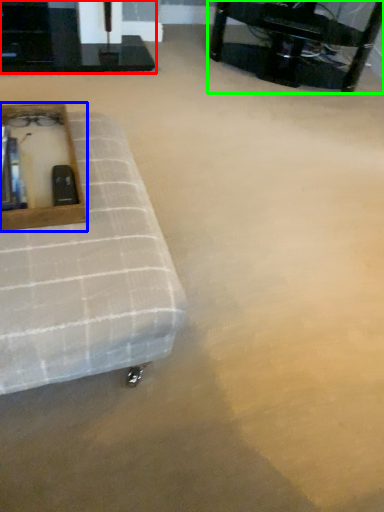
Question: Estimate the real-world distances between objects in this image. Which object is closer to table (highlighted by a red box), vanity (highlighted by a blue box) or table (highlighted by a green box)?

Choices:
 (A) vanity
 (B) table

Answer: (B)